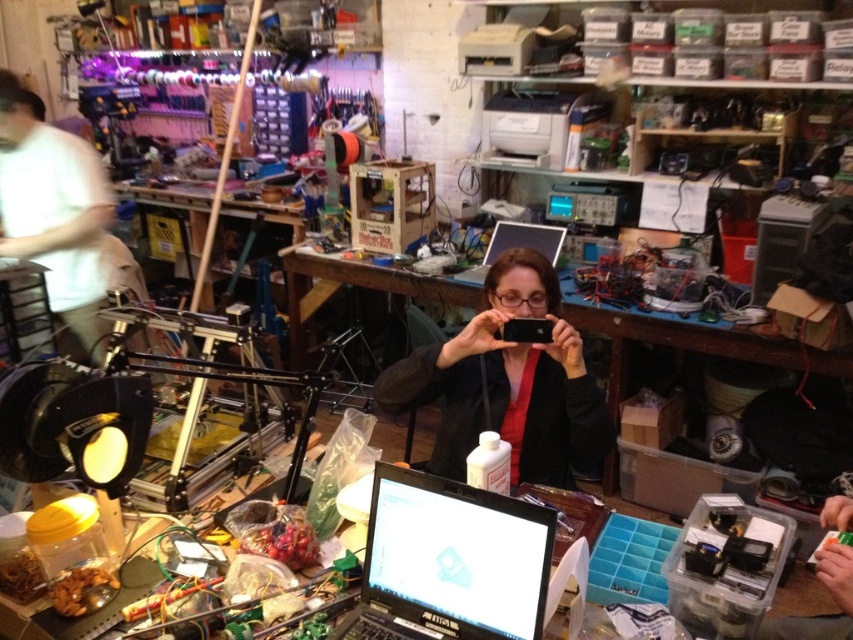
Based on the photo, which is more to the left, black matte jacket at center or wooden table at center?

wooden table at center is more to the left.

Who is shorter, black matte jacket at center or wooden table at center?

Standing shorter between the two is wooden table at center.

You are a GUI agent. You are given a task and a screenshot of the screen. Output one action in this format:
    pyautogui.click(x=<x>, y=<y>)
    Task: Click on the black matte jacket at center
    This screenshot has height=640, width=853.
    Given the screenshot: What is the action you would take?
    pyautogui.click(x=508, y=381)

Is black glossy laptop at center to the right of wooden table at center from the viewer's perspective?

Correct, you'll find black glossy laptop at center to the right of wooden table at center.

Is black glossy laptop at center below wooden table at center?

Yes.

The width and height of the screenshot is (853, 640). Describe the element at coordinates (450, 563) in the screenshot. I see `black glossy laptop at center` at that location.

Locate an element on the screen. This screenshot has width=853, height=640. black glossy laptop at center is located at coordinates (450, 563).

Measure the distance from black glossy laptop at center to silver metallic laptop at center.

black glossy laptop at center and silver metallic laptop at center are 6.25 feet apart.

Is black glossy laptop at center positioned behind silver metallic laptop at center?

No, black glossy laptop at center is closer to the viewer.

Is point (389, 573) positioned before point (558, 240)?

That is True.

The width and height of the screenshot is (853, 640). Find the location of `black glossy laptop at center`. black glossy laptop at center is located at coordinates (450, 563).